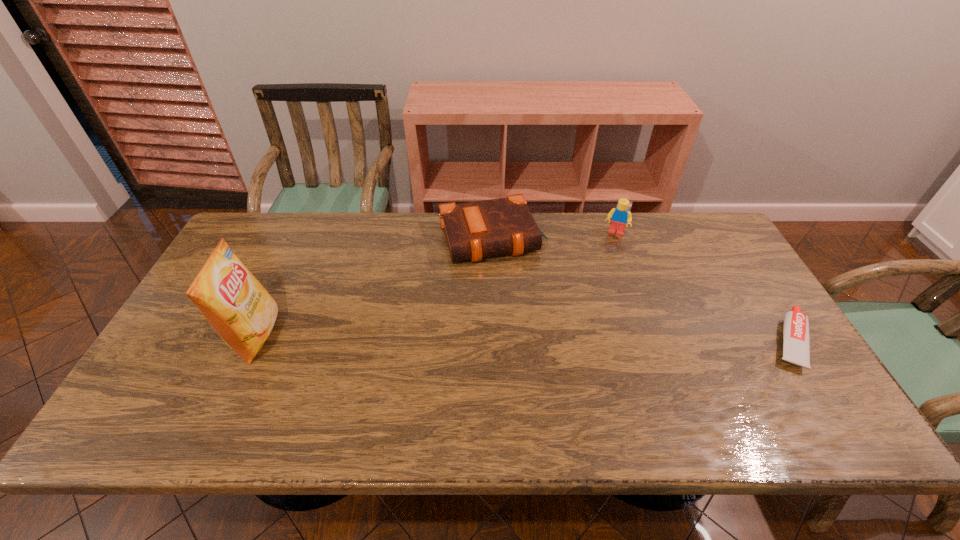
Locate an element on the screen. This screenshot has height=540, width=960. vacant point located 0.180m on the spine side of the second object from left to right is located at coordinates (521, 310).

Where is `free region located 0.110m on the spine side of the second object from left to right`? free region located 0.110m on the spine side of the second object from left to right is located at coordinates (515, 293).

This screenshot has height=540, width=960. I want to click on free spot located 0.050m on the spine side of the second object from left to right, so click(510, 278).

Find the location of a particular element. This screenshot has width=960, height=540. free space located 0.400m on the front-facing side of the second tallest object is located at coordinates (587, 327).

Identify the location of vacant space located on the front-facing side of the second tallest object. The image size is (960, 540). (591, 312).

This screenshot has width=960, height=540. Identify the location of vacant space located on the front-facing side of the second tallest object. (602, 274).

Identify the location of Bible at the far edge. The image size is (960, 540). (474, 230).

The width and height of the screenshot is (960, 540). I want to click on Lego that is at the far edge, so click(x=619, y=216).

At what (x,y) coordinates should I click in order to perform the action: click on object located at the near edge. Please return your answer as a coordinate pair (x, y). Looking at the image, I should click on (796, 342).

Where is `object that is at the left edge`? The width and height of the screenshot is (960, 540). object that is at the left edge is located at coordinates (241, 311).